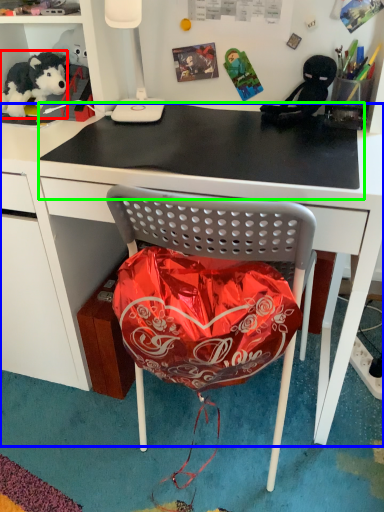
Question: Estimate the real-world distances between objects in this image. Which object is farther from teddy bear (highlighted by a red box), desk (highlighted by a blue box) or table top (highlighted by a green box)?

Choices:
 (A) desk
 (B) table top

Answer: (A)